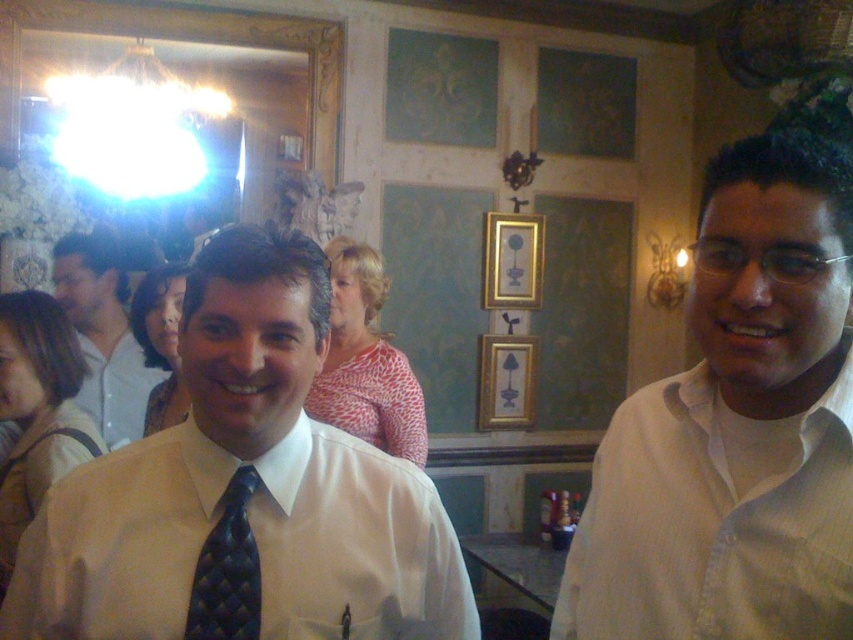
Question: Which point is farther to the camera?

Choices:
 (A) gold-framed picture at center
 (B) white shirt at right

Answer: (A)

Question: Estimate the real-world distances between objects in this image. Which object is closer to the gold/gilded picture frame at upper center?

Choices:
 (A) white shirt at right
 (B) black woven tie at center

Answer: (A)

Question: Which point is farther from the camera taking this photo?

Choices:
 (A) (173, 620)
 (B) (488, 394)
 (C) (492, 289)

Answer: (B)

Question: Does white shirt at center have a greater width compared to white shirt at right?

Choices:
 (A) yes
 (B) no

Answer: (A)

Question: Does black woven tie at center have a smaller size compared to gold/gilded picture frame at upper center?

Choices:
 (A) yes
 (B) no

Answer: (A)

Question: Can you confirm if matte white shirt at center is wider than black woven tie at center?

Choices:
 (A) no
 (B) yes

Answer: (B)